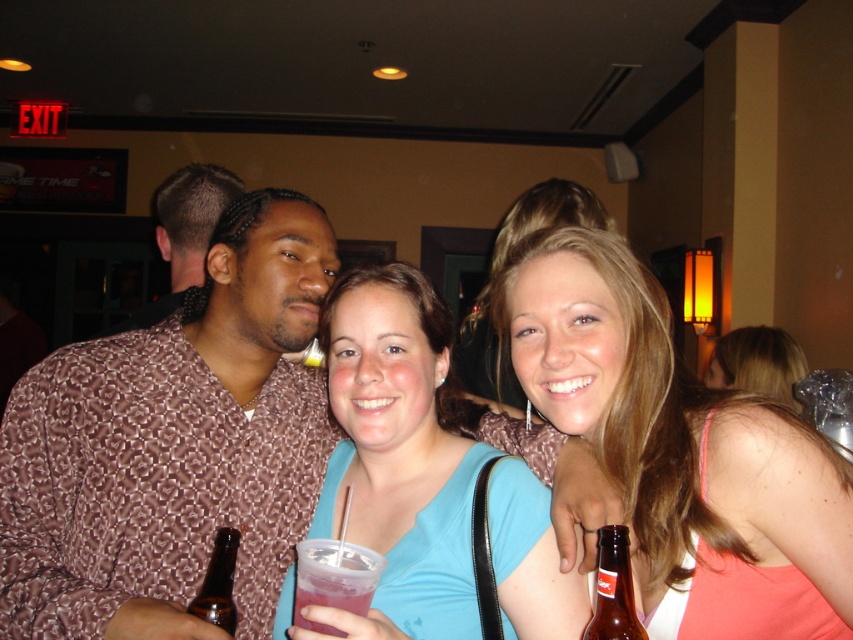
You are at a party and want to grab the pink translucent cup at center without touching the blue fabric shirt at center. Is this possible?

The blue fabric shirt at center is positioned over the pink translucent cup at center, so you cannot grab the pink translucent cup at center without touching the blue fabric shirt at center.

You are standing at the entrance of the venue and want to locate the blue fabric shirt at center. According to the coordinates provided, in which direction should you look relative to the entrance?

The blue fabric shirt at center is located at coordinates point (398,454). To locate it, you should look towards the center of the image from the entrance.

You are at a party and need to grab the brown glass bottle at lower left without disturbing the person in the brown textured shirt at left. Can you reach it easily?

The brown textured shirt at left is located above the brown glass bottle at lower left, so you can reach the brown glass bottle at lower left easily without disturbing the person.